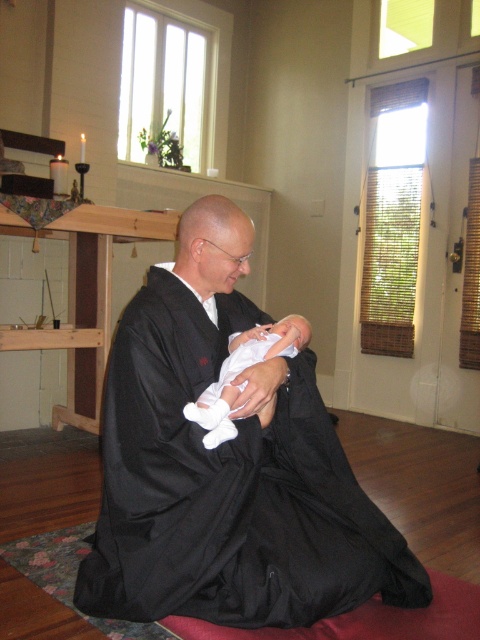
You are a photographer setting up a shoot in this room. You need to ensure that the white matte dress at center and the white soft fabric newborn at center are both visible in the frame. Given their sizes, which object should you focus on to ensure both are in the shot without cropping?

Since the white matte dress at center is bigger than the white soft fabric newborn at center, you should focus on the white matte dress at center to ensure both objects fit in the frame.

You are standing at the point closest to the window with vertical blinds. Which of the two points, point (x=343, y=515) or point (x=266, y=412), is farther away from you?

Point (x=343, y=515) is farther away from you because it is behind point (x=266, y=412).

You are an interior designer observing the scene. You need to place a decorative item between the white matte dress at center and the white soft fabric newborn at center. Which side of the newborn should you place it on?

The white matte dress at center is to the left of the white soft fabric newborn at center, so you should place the decorative item to the right side of the newborn to maintain symmetry.